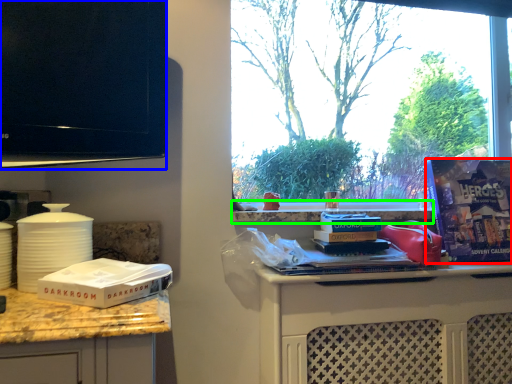
Question: Which is farther away from magazine (highlighted by a red box)? television (highlighted by a blue box) or window sill (highlighted by a green box)?

Choices:
 (A) television
 (B) window sill

Answer: (A)